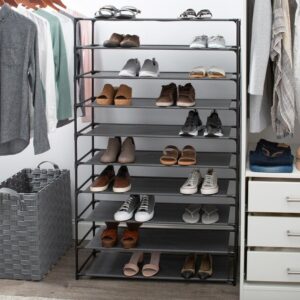
Locate an element on the screen. The width and height of the screenshot is (300, 300). wooden hanger is located at coordinates (3, 3), (14, 3), (23, 3), (39, 4), (51, 2), (57, 2).